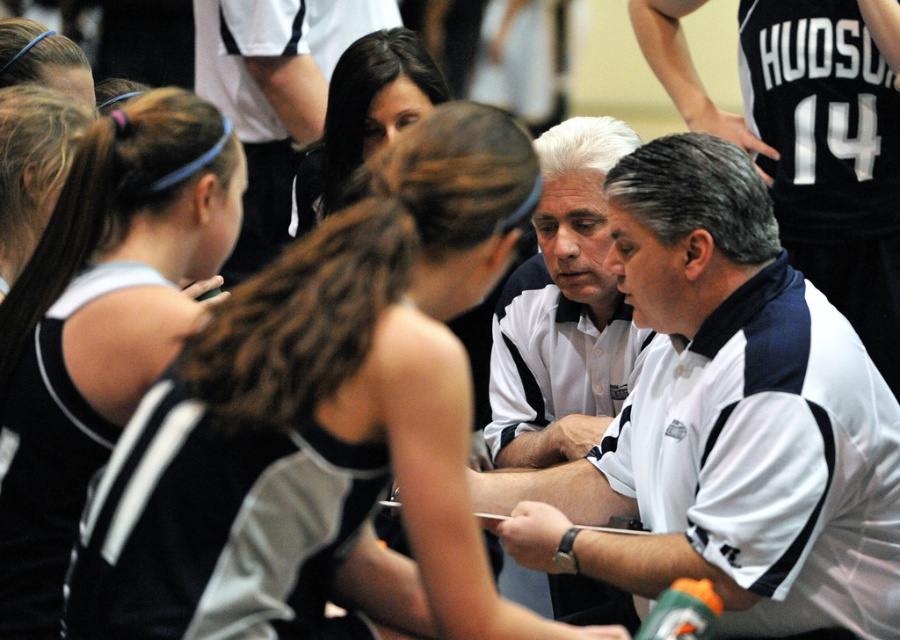
Does white/blue polo shirt at center have a smaller size compared to black jersey at left?

Incorrect, white/blue polo shirt at center is not smaller in size than black jersey at left.

Between point (794, 484) and point (73, 330), which one is positioned behind?

Point (794, 484)

Does point (495, 488) lie in front of point (14, 636)?

No, it is behind (14, 636).

Identify the location of white/blue polo shirt at center. (726, 419).

Is white/blue polo shirt at center bigger than white polo shirt at center?

Correct, white/blue polo shirt at center is larger in size than white polo shirt at center.

Is white/blue polo shirt at center to the right of white polo shirt at center from the viewer's perspective?

Correct, you'll find white/blue polo shirt at center to the right of white polo shirt at center.

Image resolution: width=900 pixels, height=640 pixels. What do you see at coordinates (726, 419) in the screenshot?
I see `white/blue polo shirt at center` at bounding box center [726, 419].

Identify the location of white/blue polo shirt at center. (726, 419).

Can you confirm if white/blue polo shirt at center is positioned to the left of smooth brown hair at center?

No, white/blue polo shirt at center is not to the left of smooth brown hair at center.

Describe the element at coordinates (726, 419) in the screenshot. Image resolution: width=900 pixels, height=640 pixels. I see `white/blue polo shirt at center` at that location.

Locate an element on the screen. This screenshot has width=900, height=640. white/blue polo shirt at center is located at coordinates (726, 419).